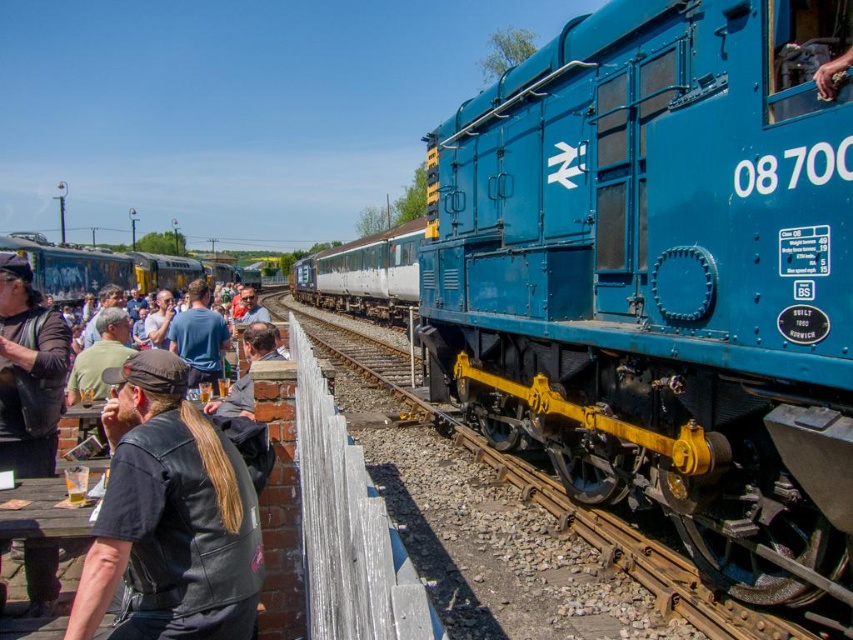
Who is lower down, wooden picnic table at lower left or blue painted steel train at left?

Positioned lower is wooden picnic table at lower left.

Is point (61, 508) less distant than point (33, 252)?

Yes, it is.

Image resolution: width=853 pixels, height=640 pixels. Identify the location of wooden picnic table at lower left. (42, 532).

Where is `wooden picnic table at lower left`? This screenshot has height=640, width=853. wooden picnic table at lower left is located at coordinates (42, 532).

Does black leather jacket at lower left come behind wooden picnic table at lower left?

No, black leather jacket at lower left is closer to the viewer.

Who is shorter, black leather jacket at lower left or wooden picnic table at lower left?

wooden picnic table at lower left

Is point (242, 579) positioned before point (71, 566)?

Yes, it is in front of point (71, 566).

At what (x,y) coordinates should I click in order to perform the action: click on black leather jacket at lower left. Please return your answer as a coordinate pair (x, y). This screenshot has width=853, height=640. Looking at the image, I should click on (169, 516).

Does point (670, 563) lie behind point (212, 380)?

No, (670, 563) is closer to viewer.

Does point (526, 493) lie behind point (186, 344)?

That is False.

Find the location of a particular element. The image size is (853, 640). yellow metal train track at center is located at coordinates (598, 529).